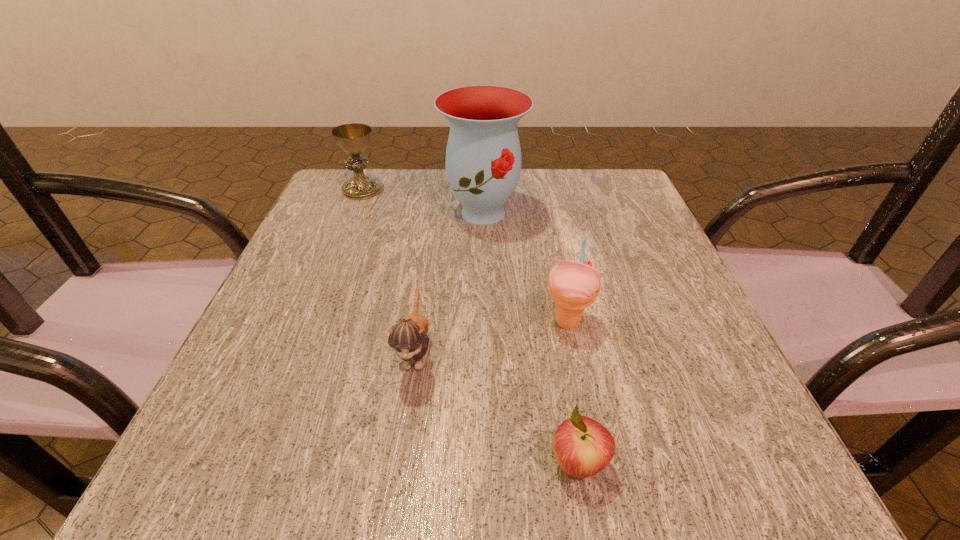
I want to click on free space at the near left corner of the desktop, so click(188, 450).

Locate an element on the screen. The height and width of the screenshot is (540, 960). vacant space at the far right corner of the desktop is located at coordinates (587, 190).

Locate an element on the screen. The image size is (960, 540). vacant area at the near right corner of the desktop is located at coordinates (771, 456).

The height and width of the screenshot is (540, 960). In order to click on vacant space that's between the icecream and the nearest object in this screenshot , I will do `click(572, 394)`.

At what (x,y) coordinates should I click in order to perform the action: click on vacant space that's between the kitten and the nearest object. Please return your answer as a coordinate pair (x, y). Image resolution: width=960 pixels, height=540 pixels. Looking at the image, I should click on (496, 407).

In order to click on unoccupied position between the chalice and the kitten in this screenshot , I will do `click(389, 270)`.

This screenshot has height=540, width=960. Identify the location of vacant space in between the vase and the chalice. (422, 201).

The width and height of the screenshot is (960, 540). Identify the location of free point between the apple and the icecream. (572, 394).

You are a GUI agent. You are given a task and a screenshot of the screen. Output one action in this format:
    pyautogui.click(x=<x>, y=<y>)
    Task: Click on the vacant area that lies between the kitten and the apple
    
    Given the screenshot: What is the action you would take?
    pyautogui.click(x=496, y=407)

The height and width of the screenshot is (540, 960). I want to click on vacant area that lies between the icecream and the chalice, so click(465, 256).